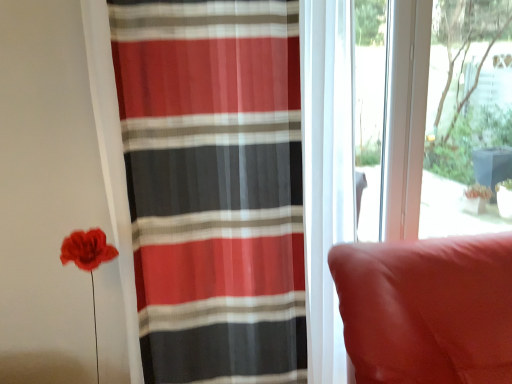
Find the location of a particular element. The image size is (512, 384). suede-like red cushion at right is located at coordinates (426, 309).

Measure the distance between point (367, 362) and camera.

3.91 feet.

What do you see at coordinates (467, 115) in the screenshot? Image resolution: width=512 pixels, height=384 pixels. I see `transparent glass window screen at upper right` at bounding box center [467, 115].

At what (x,y) coordinates should I click in order to perform the action: click on suede-like red cushion at right. Please return your answer as a coordinate pair (x, y). The width and height of the screenshot is (512, 384). Looking at the image, I should click on (426, 309).

Who is taller, suede-like red cushion at right or striped sheer curtain at left?

With more height is striped sheer curtain at left.

Which is closer, (489,238) or (139,62)?

Point (489,238) appears to be farther away from the viewer than point (139,62).

Is suede-like red cushion at right positioned with its back to striped sheer curtain at left?

No.

Does point (496, 364) come behind point (420, 223)?

That is False.

Would you say suede-like red cushion at right is outside transparent glass window screen at upper right?

Yes.

Is suede-like red cushion at right shorter than transparent glass window screen at upper right?

Yes.

Looking at this image, is striped sheer curtain at left not near transparent glass window screen at upper right?

Indeed, striped sheer curtain at left is not near transparent glass window screen at upper right.

Is striped sheer curtain at left positioned in front of transparent glass window screen at upper right?

Yes, striped sheer curtain at left is closer to the viewer.

Is striped sheer curtain at left to the left of transparent glass window screen at upper right from the viewer's perspective?

Indeed, striped sheer curtain at left is positioned on the left side of transparent glass window screen at upper right.

Is the depth of striped sheer curtain at left less than that of suede-like red cushion at right?

No.

Does striped sheer curtain at left touch suede-like red cushion at right?

No, striped sheer curtain at left is not beside suede-like red cushion at right.

Does striped sheer curtain at left have a greater height compared to suede-like red cushion at right?

Correct, striped sheer curtain at left is much taller as suede-like red cushion at right.

From the picture: Could you tell me if striped sheer curtain at left is turned towards suede-like red cushion at right?

No, striped sheer curtain at left is not facing towards suede-like red cushion at right.

From a real-world perspective, is transparent glass window screen at upper right physically located above or below suede-like red cushion at right?

transparent glass window screen at upper right is above suede-like red cushion at right.

How different are the orientations of transparent glass window screen at upper right and suede-like red cushion at right in degrees?

There is a 6.19-degree angle between the facing directions of transparent glass window screen at upper right and suede-like red cushion at right.

Can you confirm if transparent glass window screen at upper right is taller than suede-like red cushion at right?

Correct, transparent glass window screen at upper right is much taller as suede-like red cushion at right.

Relative to suede-like red cushion at right, is transparent glass window screen at upper right in front or behind?

Clearly, transparent glass window screen at upper right is behind suede-like red cushion at right.

Considering the relative sizes of transparent glass window screen at upper right and striped sheer curtain at left in the image provided, is transparent glass window screen at upper right bigger than striped sheer curtain at left?

No.

From the image's perspective, is transparent glass window screen at upper right over striped sheer curtain at left?

Indeed, from the image's perspective, transparent glass window screen at upper right is shown above striped sheer curtain at left.

Is transparent glass window screen at upper right turned away from striped sheer curtain at left?

That's not correct — transparent glass window screen at upper right is not looking away from striped sheer curtain at left.

Could striped sheer curtain at left be considered to be inside transparent glass window screen at upper right?

No.

At what (x,y) coordinates should I click in order to perform the action: click on curtain above the suede-like red cushion at right (from the image's perspective). Please return your answer as a coordinate pair (x, y). Looking at the image, I should click on (214, 186).

Locate an element on the screen. furniture that is on the left side of transparent glass window screen at upper right is located at coordinates (426, 309).

Considering their positions, is striped sheer curtain at left positioned further to transparent glass window screen at upper right than suede-like red cushion at right?

striped sheer curtain at left is positioned further to the anchor transparent glass window screen at upper right.

When comparing their distances from transparent glass window screen at upper right, does suede-like red cushion at right or striped sheer curtain at left seem further?

striped sheer curtain at left is further to transparent glass window screen at upper right.

From the picture: Looking at the image, which one is located closer to striped sheer curtain at left, suede-like red cushion at right or transparent glass window screen at upper right?

suede-like red cushion at right lies closer to striped sheer curtain at left than the other object.

Looking at this image, based on their spatial positions, is striped sheer curtain at left or transparent glass window screen at upper right further from suede-like red cushion at right?

Among the two, transparent glass window screen at upper right is located further to suede-like red cushion at right.

Considering their positions, is transparent glass window screen at upper right positioned closer to suede-like red cushion at right than striped sheer curtain at left?

striped sheer curtain at left is closer to suede-like red cushion at right.

Considering their positions, is transparent glass window screen at upper right positioned further to striped sheer curtain at left than suede-like red cushion at right?

transparent glass window screen at upper right lies further to striped sheer curtain at left than the other object.

At what (x,y) coordinates should I click in order to perform the action: click on furniture situated between striped sheer curtain at left and transparent glass window screen at upper right from left to right. Please return your answer as a coordinate pair (x, y). This screenshot has height=384, width=512. Looking at the image, I should click on (426, 309).